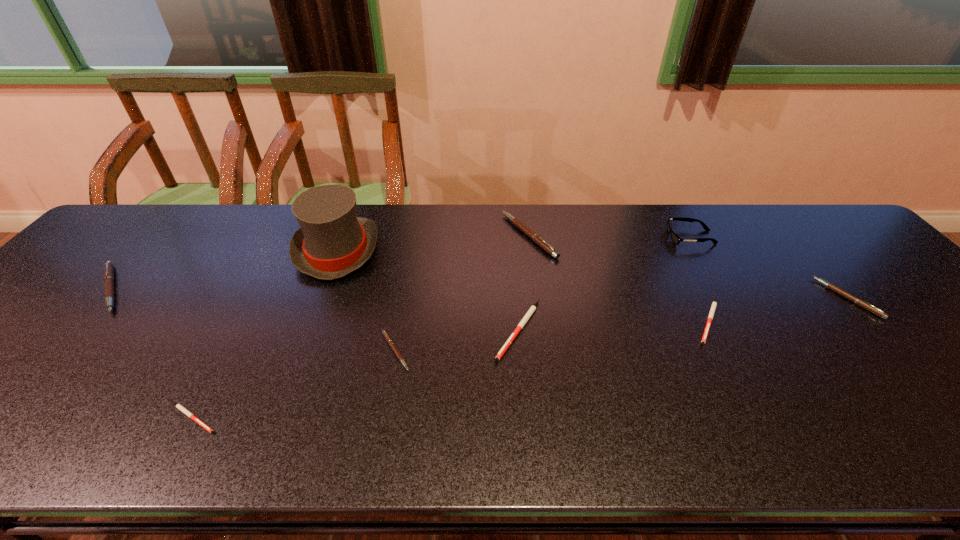
The width and height of the screenshot is (960, 540). Identify the location of gray dress hat. (332, 242).

In order to click on dress hat in this screenshot , I will do `click(332, 242)`.

I want to click on the second tallest object, so click(676, 239).

Locate an element on the screen. This screenshot has width=960, height=540. sunglasses is located at coordinates (676, 239).

Where is `the tallest pen`? the tallest pen is located at coordinates (534, 237).

Image resolution: width=960 pixels, height=540 pixels. I want to click on the second pink pen from right to left, so click(534, 237).

Locate an element on the screen. Image resolution: width=960 pixels, height=540 pixels. the leftmost object is located at coordinates (108, 269).

Find the location of a particular element. Image resolution: width=960 pixels, height=540 pixels. the third smallest pink pen is located at coordinates (108, 269).

This screenshot has height=540, width=960. In order to click on the rightmost object in this screenshot , I will do `click(858, 301)`.

The width and height of the screenshot is (960, 540). What are the coordinates of `the rightmost pen` in the screenshot? It's located at click(x=858, y=301).